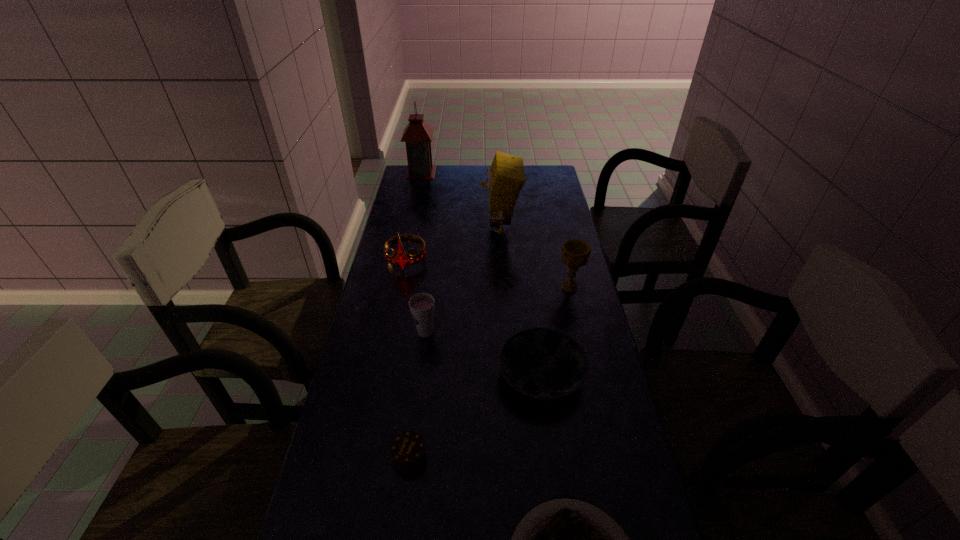
At what (x,y) coordinates should I click in order to perform the action: click on free point that satisfies the following two spatial constraints: 1. on the front-facing side of the tiara; 2. on the left side of the second nearest object. Please return your answer as a coordinate pair (x, y). Looking at the image, I should click on (367, 456).